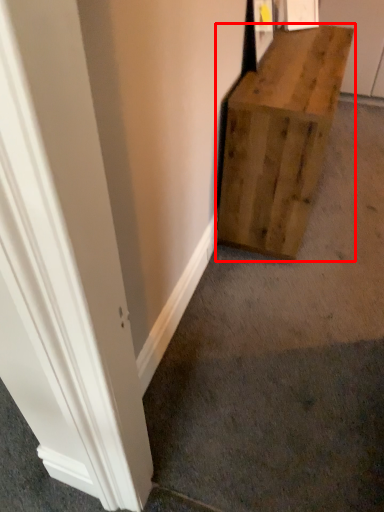
Question: From the image's perspective, where is furniture (annotated by the red box) located in relation to concrete in the image?

Choices:
 (A) above
 (B) below

Answer: (A)